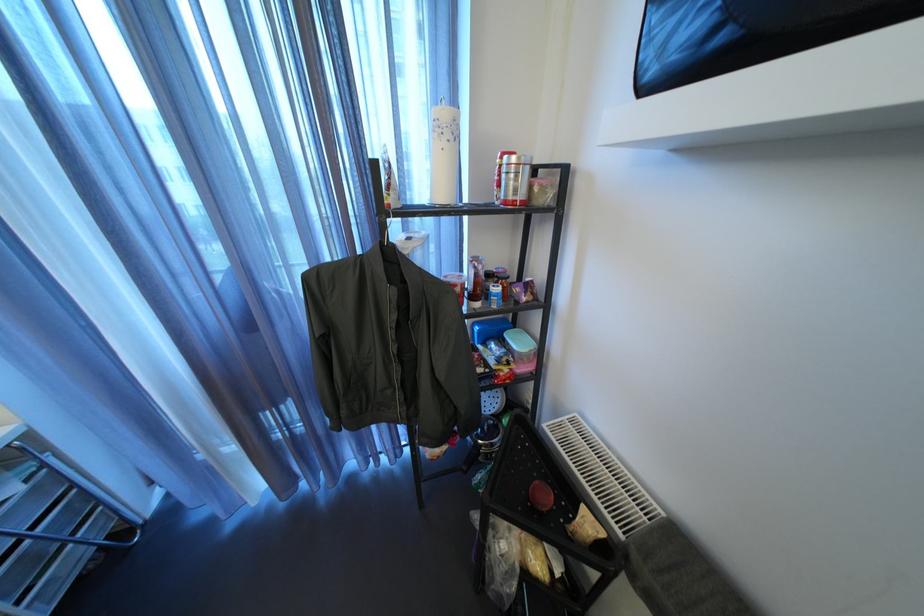
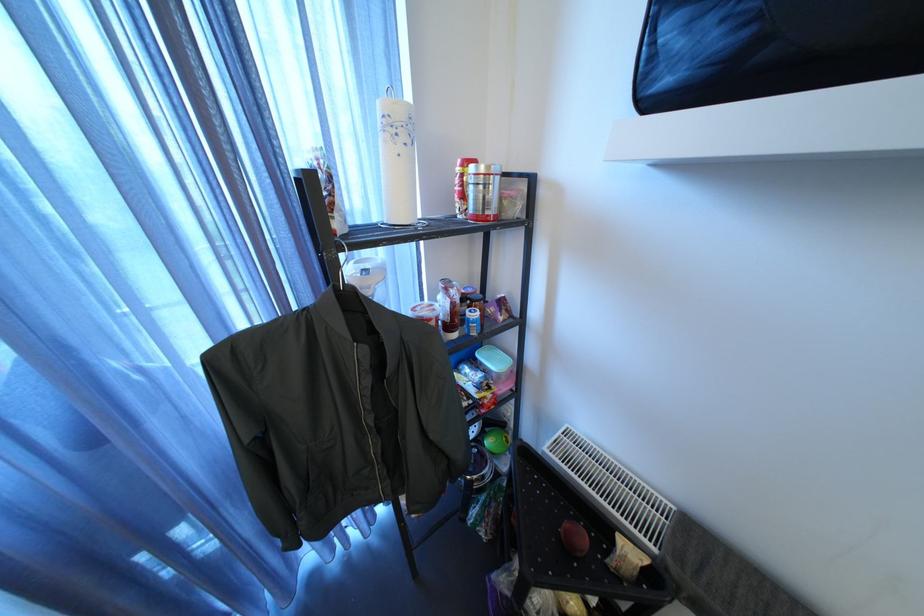
Question: The first image is from the beginning of the video and the second image is from the end. How did the camera likely rotate when shooting the video?

Choices:
 (A) Left
 (B) Right
 (C) Up
 (D) Down

Answer: (B)